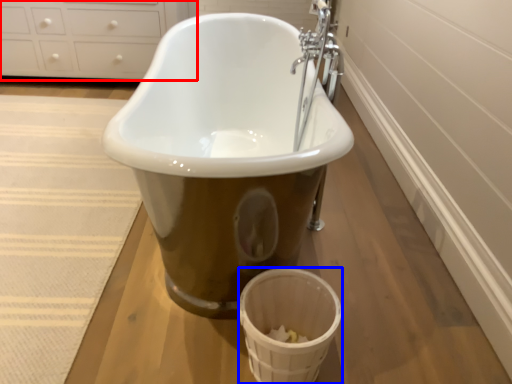
Question: Which of the following is the farthest to the observer, cabinetry (highlighted by a red box) or basket (highlighted by a blue box)?

Choices:
 (A) cabinetry
 (B) basket

Answer: (A)